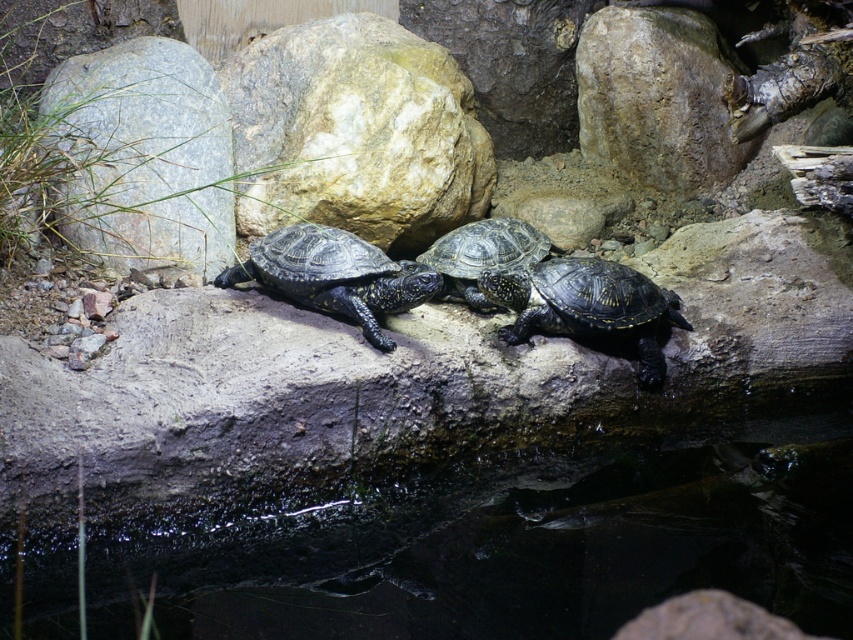
Question: Which object appears closest to the camera in this image?

Choices:
 (A) shiny dark green tortoise at center
 (B) shiny black turtle at center
 (C) shiny black tortoise at center

Answer: (C)

Question: Which of the following is the closest to the observer?

Choices:
 (A) (666, 532)
 (B) (321, 289)
 (C) (451, 250)
 (D) (331, 108)

Answer: (A)

Question: From the image, what is the correct spatial relationship of black glossy water at lower center in relation to shiny black turtle at center?

Choices:
 (A) above
 (B) below

Answer: (B)

Question: Is gray rock at center to the left of shiny dark green tortoise at center from the viewer's perspective?

Choices:
 (A) no
 (B) yes

Answer: (B)

Question: Is shiny black turtle at center positioned in front of shiny dark green tortoise at center?

Choices:
 (A) no
 (B) yes

Answer: (B)

Question: Which of the following is the closest to the observer?

Choices:
 (A) (548, 262)
 (B) (80, 122)
 (C) (300, 106)

Answer: (A)